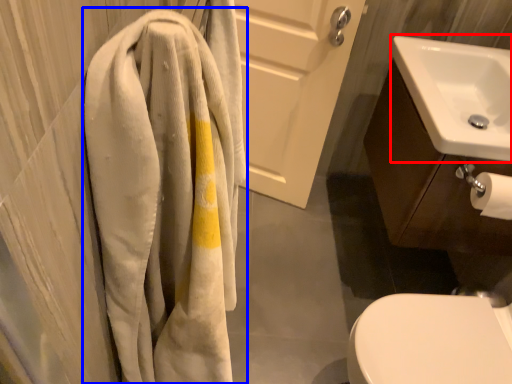
Question: Among these objects, which one is farthest to the camera, sink (highlighted by a red box) or towel (highlighted by a blue box)?

Choices:
 (A) sink
 (B) towel

Answer: (A)